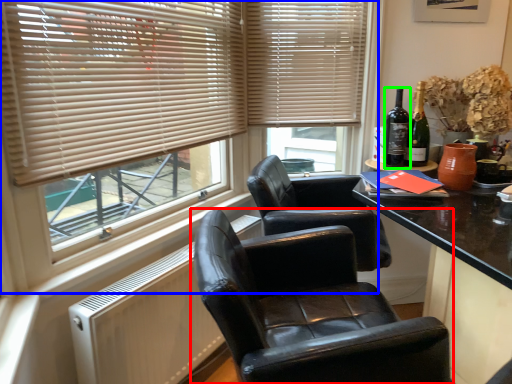
Question: Which object is positioned farthest from chair (highlighted by a red box)? Select from window (highlighted by a blue box) and bottle (highlighted by a green box).

Choices:
 (A) window
 (B) bottle

Answer: (B)